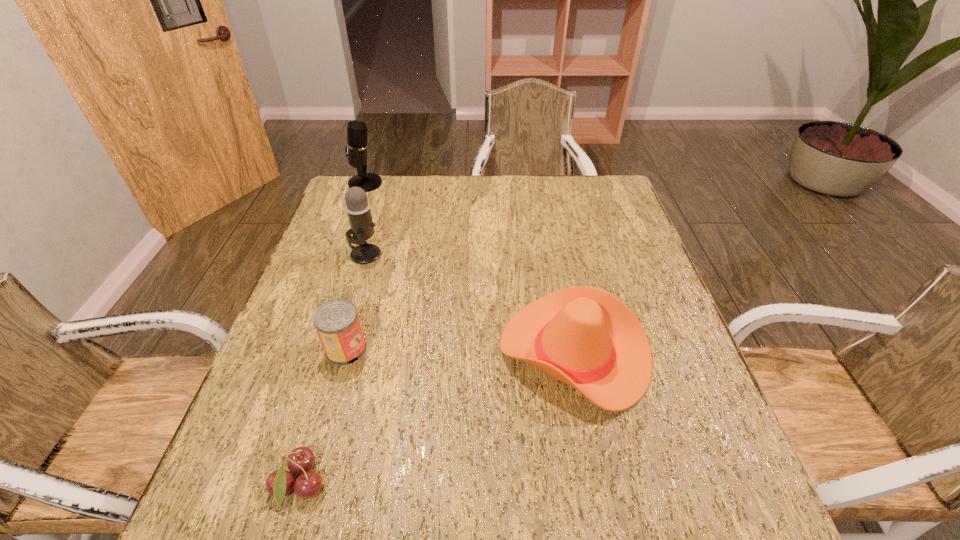
The height and width of the screenshot is (540, 960). I want to click on the farther microphone, so click(x=356, y=148).

The image size is (960, 540). What are the coordinates of `the fourth nearest object` in the screenshot? It's located at (358, 208).

In order to click on the third tallest object in this screenshot , I will do `click(583, 336)`.

Image resolution: width=960 pixels, height=540 pixels. Find the location of `cowboy hat`. cowboy hat is located at coordinates (583, 336).

Where is `the second shortest object`? The image size is (960, 540). the second shortest object is located at coordinates (337, 323).

Locate an element on the screen. This screenshot has height=540, width=960. cherry is located at coordinates (279, 483).

Where is `the nearest object`? the nearest object is located at coordinates (279, 483).

Find the location of `vacant space positioned on the right of the farthest object`. vacant space positioned on the right of the farthest object is located at coordinates (499, 184).

This screenshot has height=540, width=960. In order to click on free location located 0.390m on the front of the fourth nearest object in this screenshot , I will do `click(325, 390)`.

Where is `vacant space positioned on the left of the third shortest object`? The width and height of the screenshot is (960, 540). vacant space positioned on the left of the third shortest object is located at coordinates [455, 352].